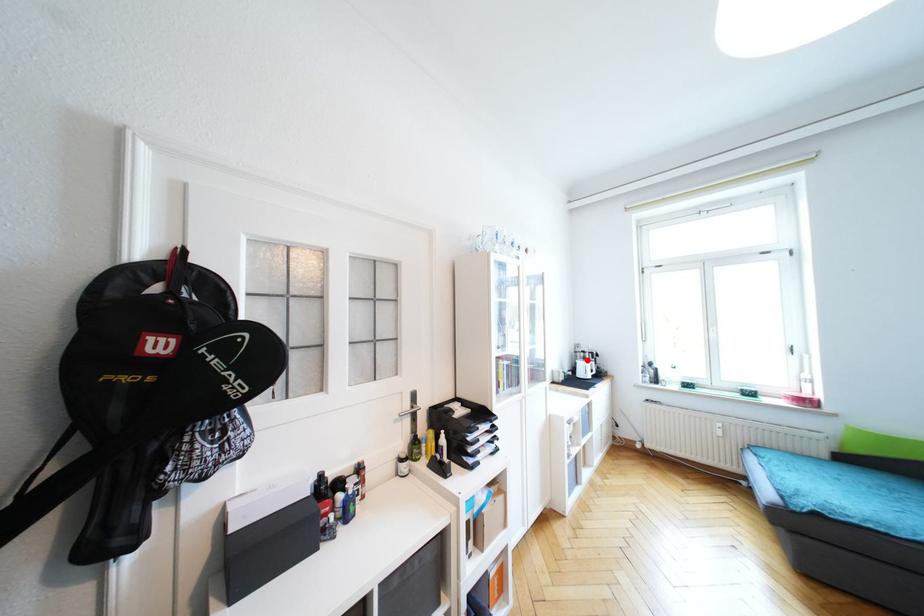
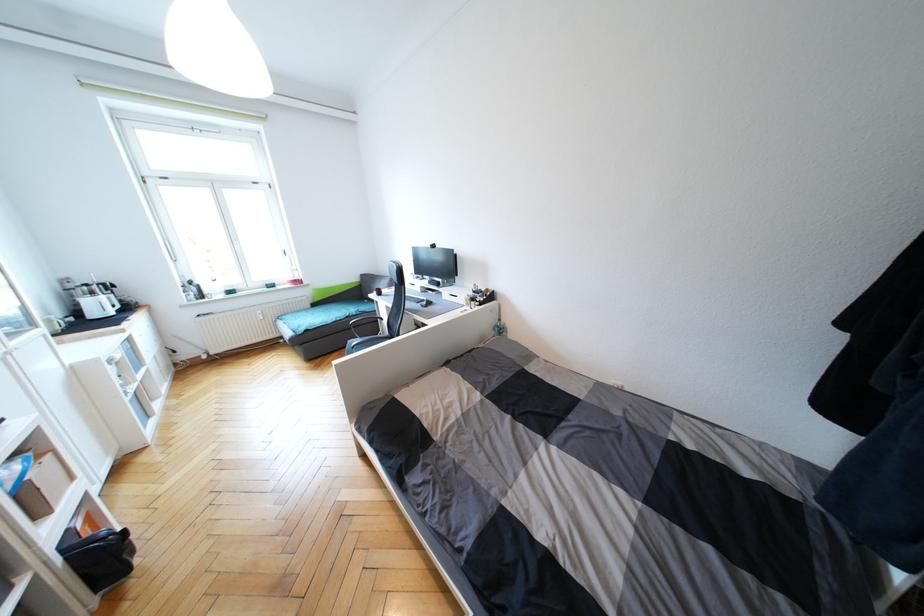
Where in the second image is the point corresponding to the highlighted location from the first image?

(95, 294)